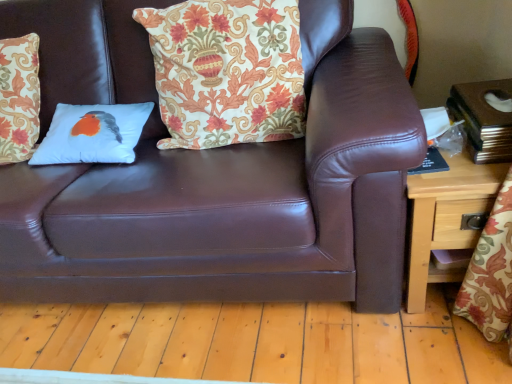
This screenshot has height=384, width=512. I want to click on free location above wooden side table at right (from a real-world perspective), so click(450, 145).